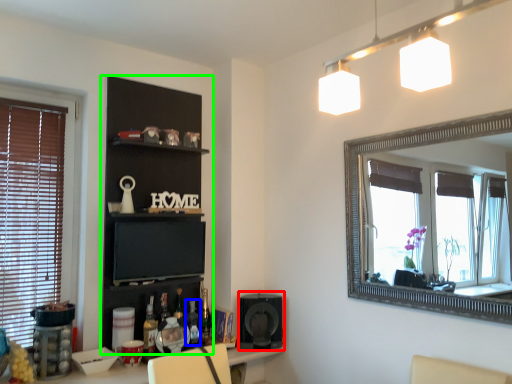
Question: Based on their relative distances, which object is nearer to speaker (highlighted by a red box)? Choose from bottle (highlighted by a blue box) and shelf (highlighted by a green box).

Choices:
 (A) bottle
 (B) shelf

Answer: (A)